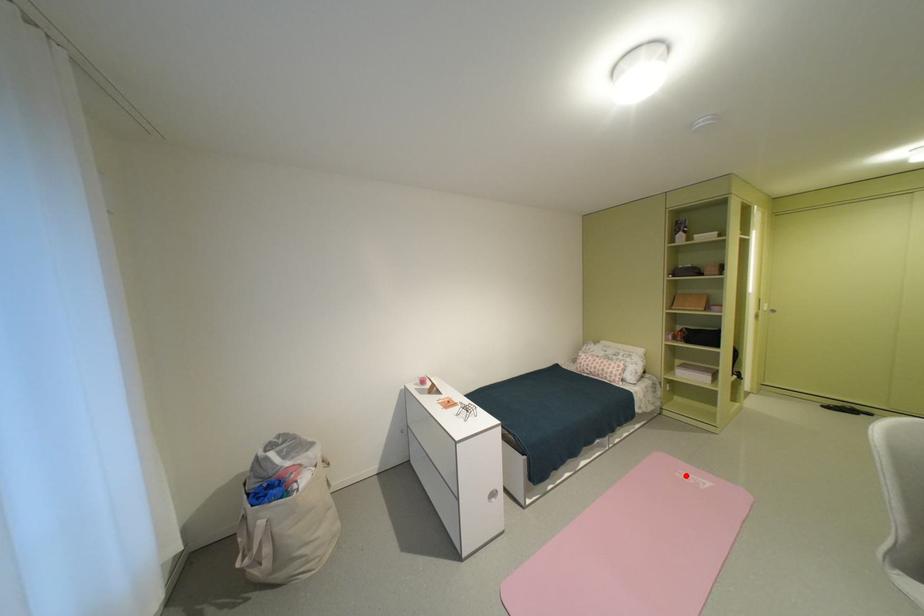
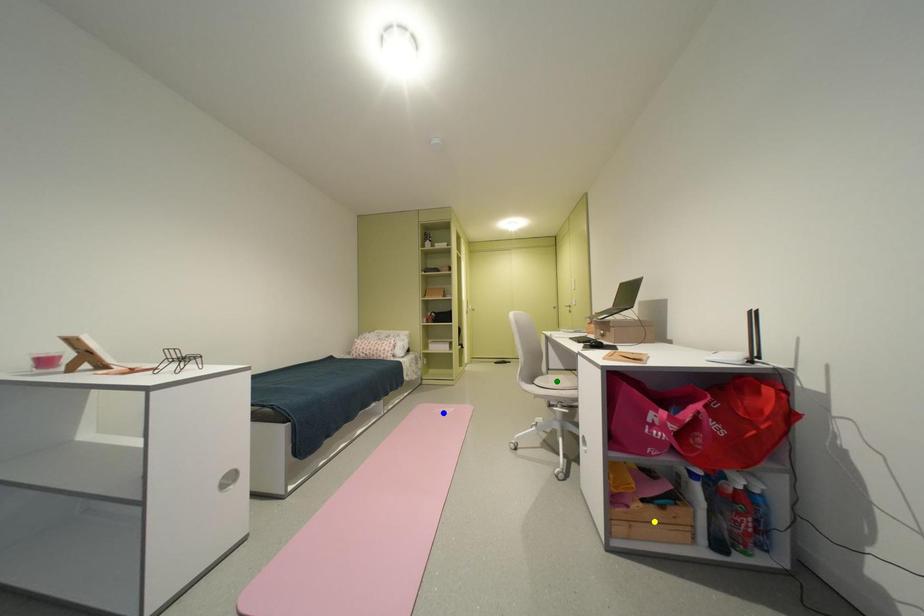
Question: I am providing you with two images of the same scene from different viewpoints. A red point is marked on the first image. You are given multiple points on the second image. Which spot in image 2 lines up with the point in image 1?

Choices:
 (A) green point
 (B) yellow point
 (C) blue point

Answer: (C)